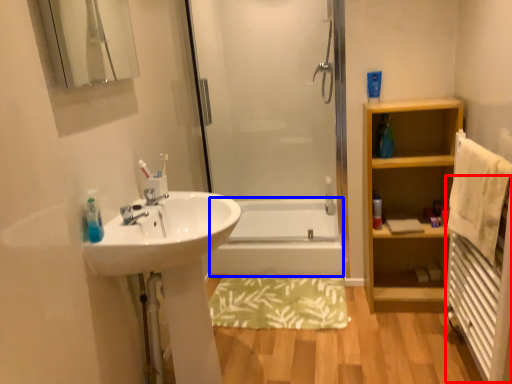
Question: Which of the following is the closest to the observer, radiator (highlighted by a red box) or bath (highlighted by a blue box)?

Choices:
 (A) radiator
 (B) bath

Answer: (A)